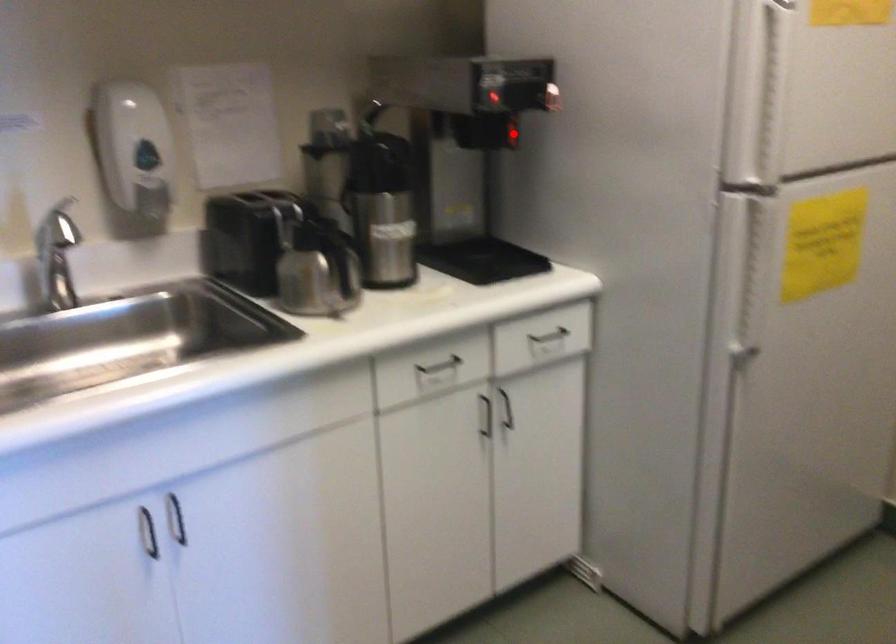
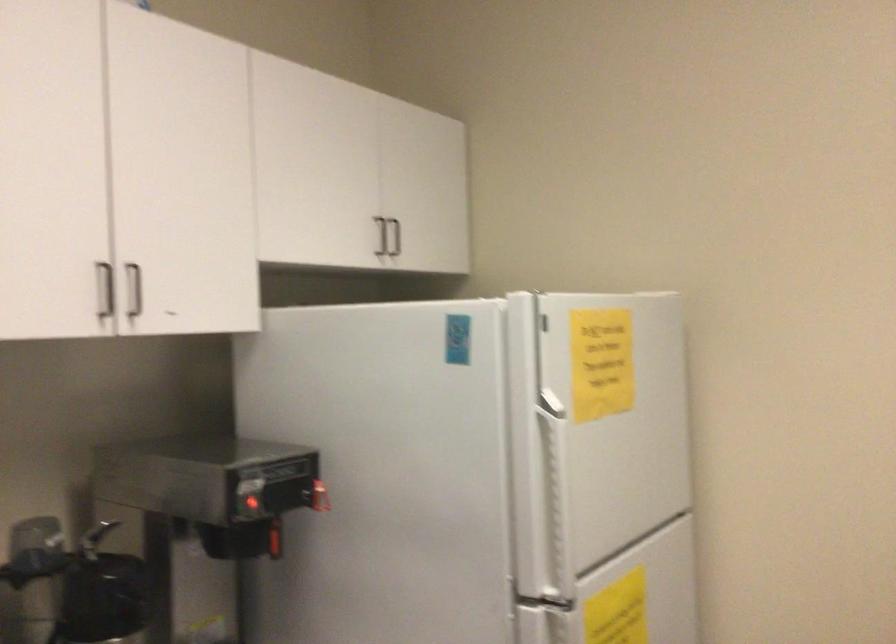
Question: I am providing you with two images of the same scene from different viewpoints. Given a red point in image1, look at the same physical point in image2. Is it:

Choices:
 (A) Closer to the viewpoint
 (B) Farther from the viewpoint

Answer: (A)